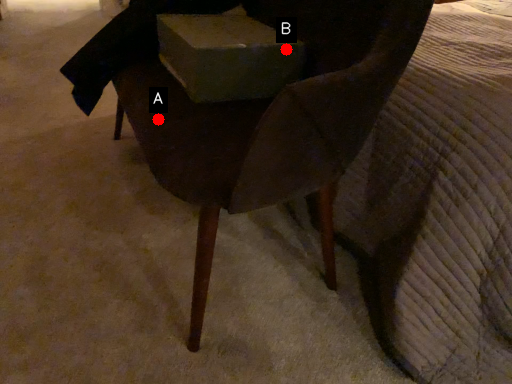
Question: Two points are circled on the image, labeled by A and B beside each circle. Which point is farther from the camera taking this photo?

Choices:
 (A) A is further
 (B) B is further

Answer: (B)